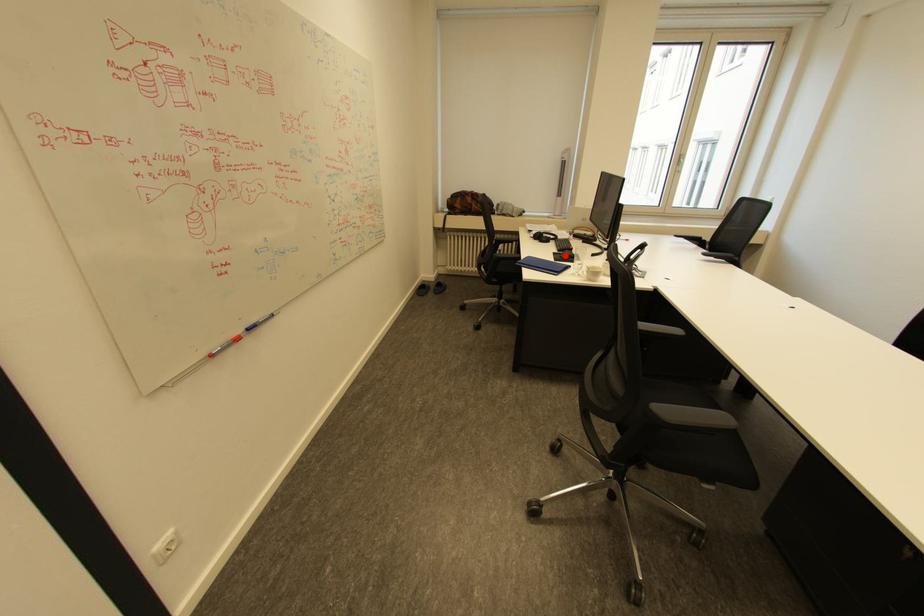
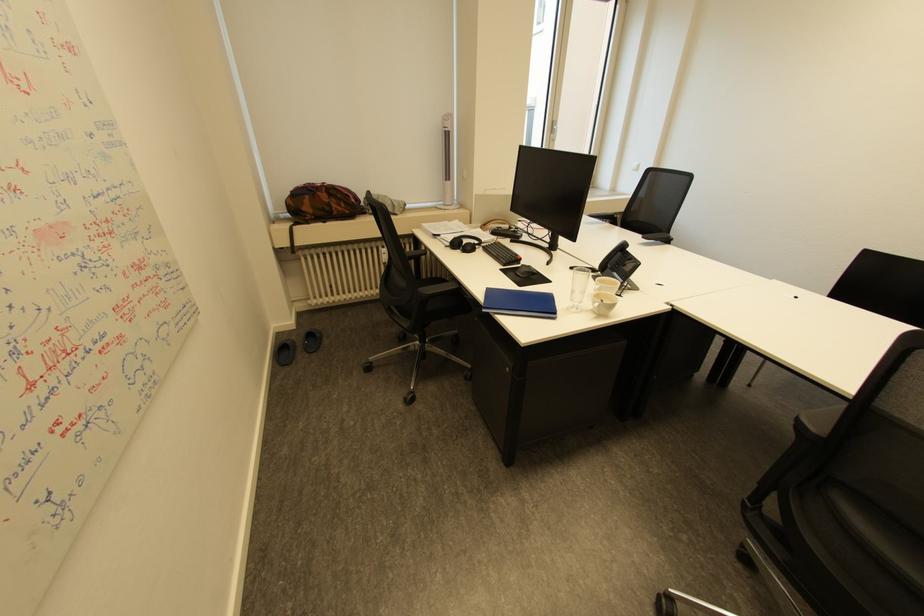
Locate, in the second image, the point that corresponds to the highlighted location in the first image.

(518, 274)